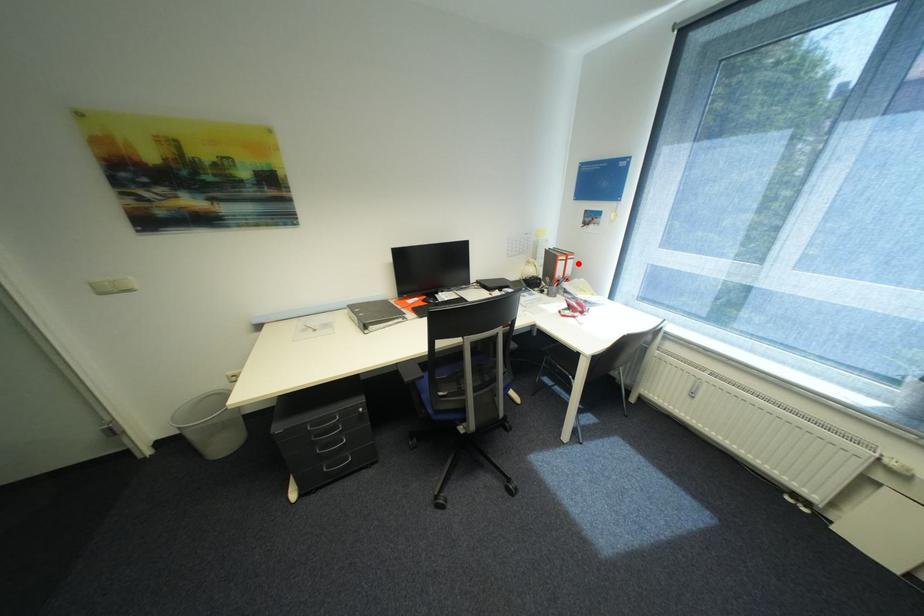
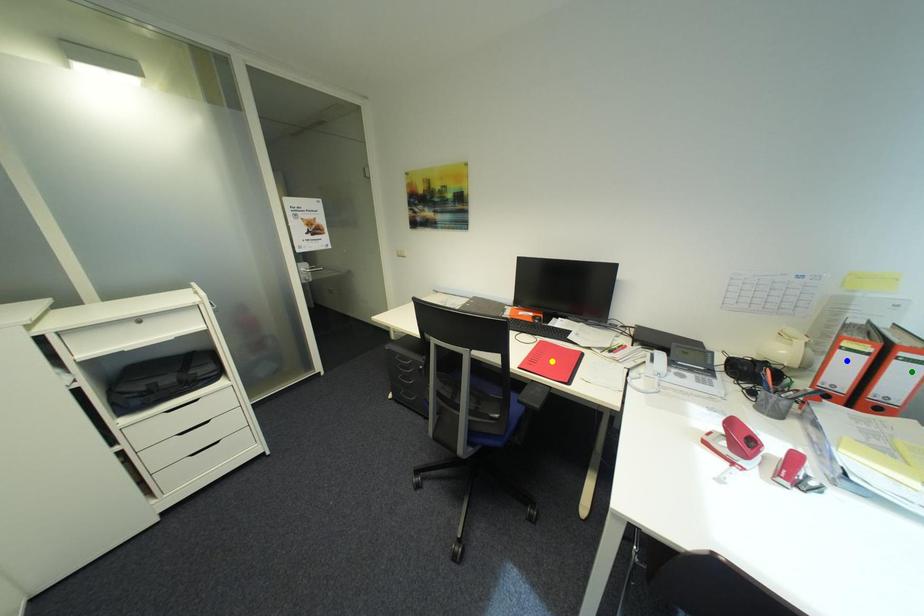
Question: I am providing you with two images of the same scene from different viewpoints. A red point is marked on the first image. You are given multiple points on the second image. Which mark in image 2 goes with the point in image 1?

Choices:
 (A) yellow point
 (B) green point
 (C) blue point

Answer: (B)